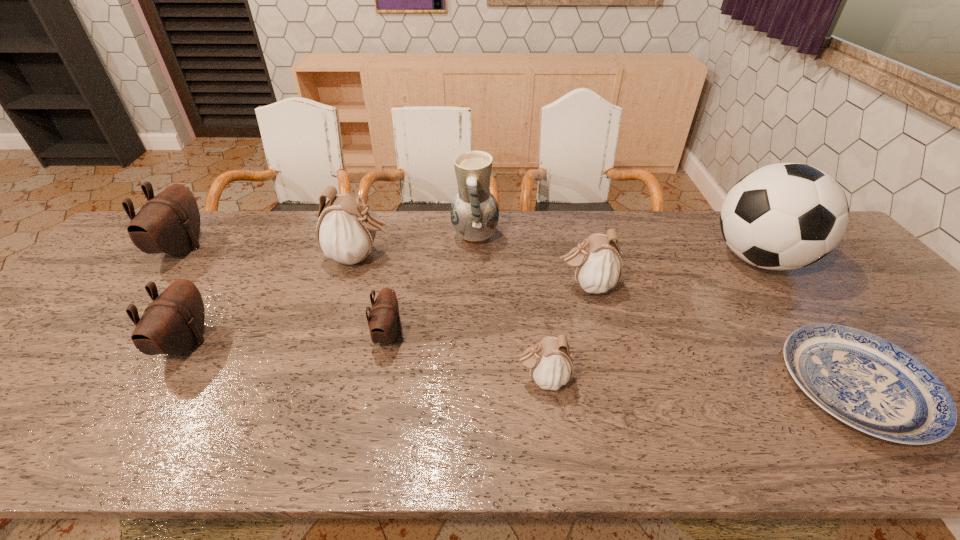
What are the coordinates of `vacant space situated 0.110m on the front-facing side of the nearest white pouch` in the screenshot? It's located at (466, 379).

Find the location of a particular element. The width and height of the screenshot is (960, 540). free location located 0.150m on the front-facing side of the nearest white pouch is located at coordinates (448, 379).

This screenshot has width=960, height=540. Find the location of `vacant space located on the front-facing side of the nearest white pouch`. vacant space located on the front-facing side of the nearest white pouch is located at coordinates (448, 379).

In order to click on vacant area situated with the flap open on the rightmost brown pouch in this screenshot , I will do `click(500, 335)`.

In order to click on soccer ball that is at the far edge in this screenshot , I will do `click(784, 216)`.

Where is `pottery that is at the far edge`? pottery that is at the far edge is located at coordinates (474, 213).

Where is `object present at the left edge`? This screenshot has height=540, width=960. object present at the left edge is located at coordinates (169, 223).

Where is `object that is at the right edge`? object that is at the right edge is located at coordinates (784, 216).

Identify the location of object at the far left corner. click(169, 223).

Where is `object located in the far right corner section of the desktop`? This screenshot has height=540, width=960. object located in the far right corner section of the desktop is located at coordinates 784,216.